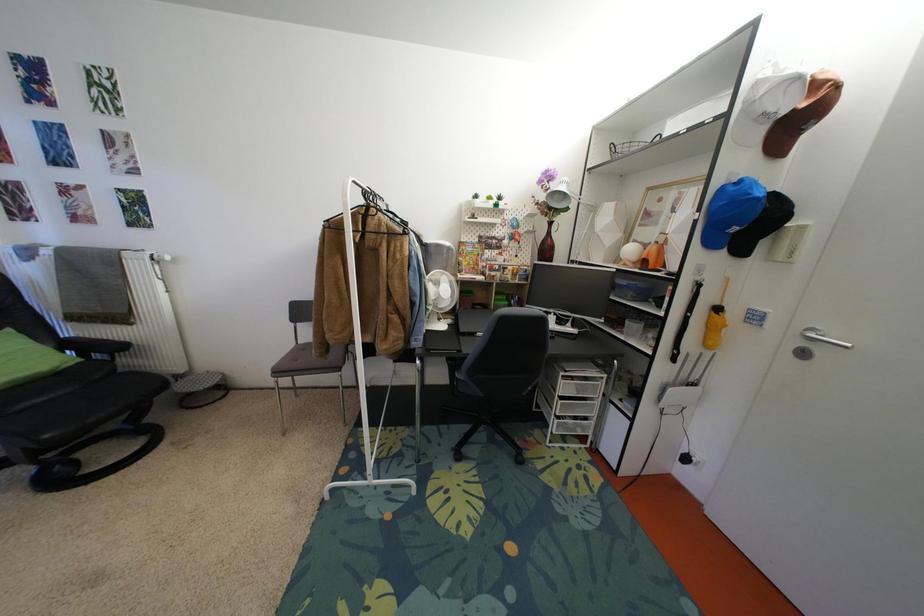
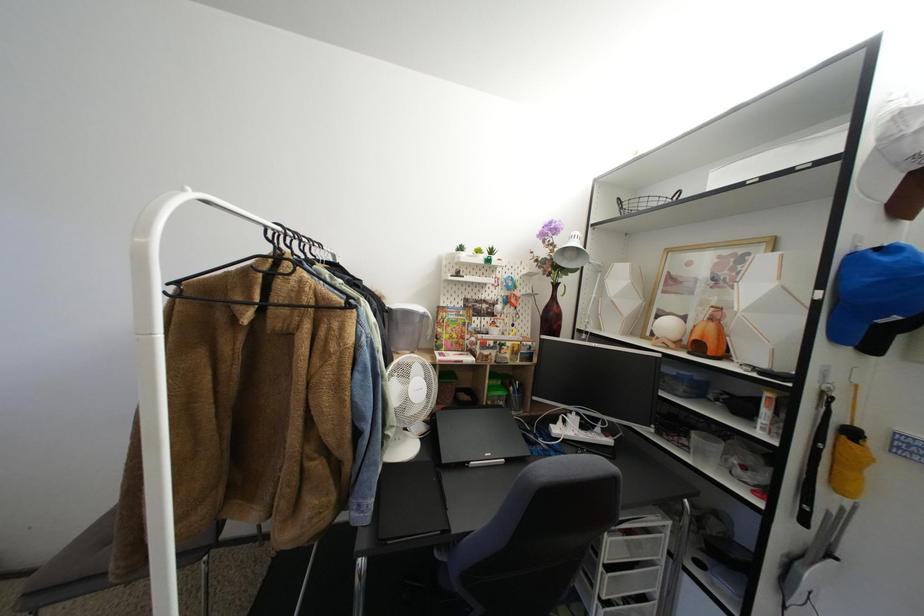
Question: The images are taken continuously from a first-person perspective. In which direction are you moving?

Choices:
 (A) Left
 (B) Right
 (C) Forward
 (D) Backward

Answer: (C)